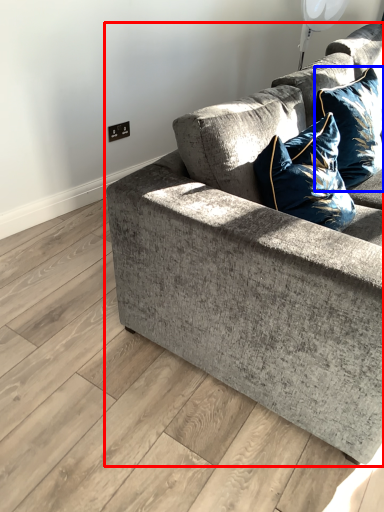
Question: Which object is closer to the camera taking this photo, studio couch (highlighted by a red box) or pillow (highlighted by a blue box)?

Choices:
 (A) studio couch
 (B) pillow

Answer: (A)